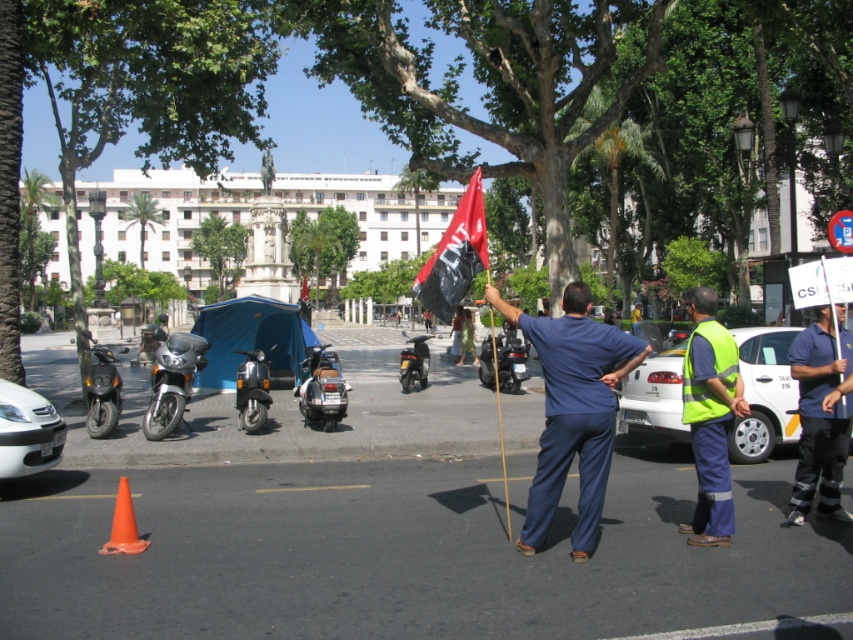
Is shiny chrome scooter at center to the left of metallic silver motorcycle at center from the viewer's perspective?

Yes, shiny chrome scooter at center is to the left of metallic silver motorcycle at center.

Consider the image. Who is lower down, shiny chrome scooter at center or metallic silver motorcycle at center?

Positioned lower is shiny chrome scooter at center.

Is point (300, 362) positioned in front of point (509, 369)?

Yes, it is in front of point (509, 369).

Where is `shiny chrome scooter at center`? The width and height of the screenshot is (853, 640). shiny chrome scooter at center is located at coordinates (322, 388).

Does shiny metallic scooter at left have a greater height compared to shiny metallic scooter at center?

Correct, shiny metallic scooter at left is much taller as shiny metallic scooter at center.

Does shiny metallic scooter at left have a lesser height compared to shiny metallic scooter at center?

Incorrect, shiny metallic scooter at left's height does not fall short of shiny metallic scooter at center's.

Between point (91, 390) and point (259, 397), which one is positioned in front?

Point (91, 390) is more forward.

Identify the location of shiny metallic scooter at left. The width and height of the screenshot is (853, 640). (99, 387).

Which is more to the left, high visibility fabric vest at right or silver metallic motorcycle at left?

From the viewer's perspective, silver metallic motorcycle at left appears more on the left side.

What do you see at coordinates (711, 417) in the screenshot? The width and height of the screenshot is (853, 640). I see `high visibility fabric vest at right` at bounding box center [711, 417].

Between point (724, 456) and point (158, 384), which one is positioned in front?

Point (724, 456) is in front.

I want to click on high visibility fabric vest at right, so click(x=711, y=417).